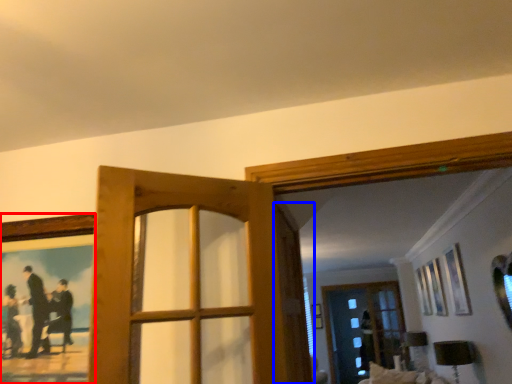
Question: Which point is further to the camera, picture frame (highlighted by a red box) or screen door (highlighted by a blue box)?

Choices:
 (A) picture frame
 (B) screen door

Answer: (B)